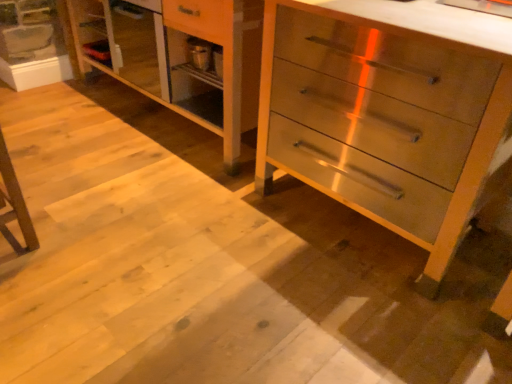
Question: Is metallic silver chest of drawers at center positioned behind light wood dresser at center?

Choices:
 (A) yes
 (B) no

Answer: (B)

Question: Is metallic silver chest of drawers at center positioned with its back to light wood dresser at center?

Choices:
 (A) no
 (B) yes

Answer: (A)

Question: From the image's perspective, does metallic silver chest of drawers at center appear higher than light wood dresser at center?

Choices:
 (A) yes
 (B) no

Answer: (B)

Question: Is metallic silver chest of drawers at center taller than light wood dresser at center?

Choices:
 (A) no
 (B) yes

Answer: (B)

Question: Can you confirm if metallic silver chest of drawers at center is thinner than light wood dresser at center?

Choices:
 (A) yes
 (B) no

Answer: (A)

Question: Is metallic silver chest of drawers at center closer to the viewer compared to light wood dresser at center?

Choices:
 (A) no
 (B) yes

Answer: (B)

Question: From the image's perspective, would you say light wood dresser at center is shown under metallic silver chest of drawers at center?

Choices:
 (A) no
 (B) yes

Answer: (A)

Question: Can you confirm if light wood dresser at center is smaller than metallic silver chest of drawers at center?

Choices:
 (A) no
 (B) yes

Answer: (A)

Question: Is light wood dresser at center next to metallic silver chest of drawers at center and touching it?

Choices:
 (A) no
 (B) yes

Answer: (A)

Question: Is light wood dresser at center not near metallic silver chest of drawers at center?

Choices:
 (A) no
 (B) yes

Answer: (A)

Question: Considering the relative sizes of light wood dresser at center and metallic silver chest of drawers at center in the image provided, is light wood dresser at center bigger than metallic silver chest of drawers at center?

Choices:
 (A) yes
 (B) no

Answer: (A)

Question: Is light wood dresser at center behind metallic silver chest of drawers at center?

Choices:
 (A) yes
 (B) no

Answer: (A)

Question: Looking at the image, does light wood dresser at center seem bigger or smaller compared to metallic silver chest of drawers at center?

Choices:
 (A) big
 (B) small

Answer: (A)